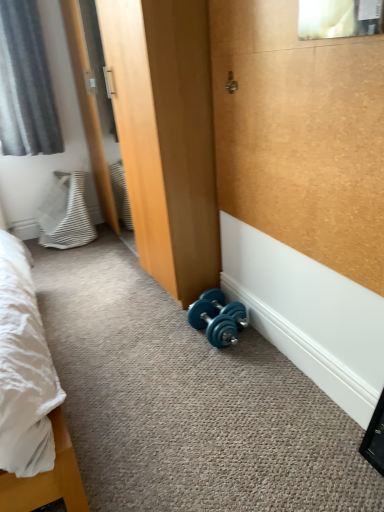
Question: Considering the relative positions of gray fabric curtain at upper left and white striped fabric pillow at left in the image provided, is gray fabric curtain at upper left in front of white striped fabric pillow at left?

Choices:
 (A) yes
 (B) no

Answer: (A)

Question: Is gray fabric curtain at upper left in contact with white striped fabric pillow at left?

Choices:
 (A) no
 (B) yes

Answer: (A)

Question: From a real-world perspective, is gray fabric curtain at upper left physically above white striped fabric pillow at left?

Choices:
 (A) yes
 (B) no

Answer: (A)

Question: Can you confirm if gray fabric curtain at upper left is shorter than white striped fabric pillow at left?

Choices:
 (A) no
 (B) yes

Answer: (A)

Question: Does gray fabric curtain at upper left turn towards white striped fabric pillow at left?

Choices:
 (A) no
 (B) yes

Answer: (A)

Question: Looking at the image, does gray fabric curtain at upper left seem bigger or smaller compared to white striped fabric pillow at left?

Choices:
 (A) big
 (B) small

Answer: (A)

Question: Looking at their shapes, would you say gray fabric curtain at upper left is wider or thinner than white striped fabric pillow at left?

Choices:
 (A) wide
 (B) thin

Answer: (B)

Question: In the image, is gray fabric curtain at upper left on the left side or the right side of white striped fabric pillow at left?

Choices:
 (A) left
 (B) right

Answer: (A)

Question: Does point (16, 31) appear closer or farther from the camera than point (82, 181)?

Choices:
 (A) farther
 (B) closer

Answer: (B)

Question: Considering the positions of teal rubber dumbbell at lower center and gray fabric curtain at upper left in the image, is teal rubber dumbbell at lower center wider or thinner than gray fabric curtain at upper left?

Choices:
 (A) thin
 (B) wide

Answer: (A)

Question: Is point (215, 316) positioned closer to the camera than point (0, 73)?

Choices:
 (A) farther
 (B) closer

Answer: (B)

Question: Is teal rubber dumbbell at lower center bigger or smaller than gray fabric curtain at upper left?

Choices:
 (A) small
 (B) big

Answer: (A)

Question: In terms of height, does teal rubber dumbbell at lower center look taller or shorter compared to gray fabric curtain at upper left?

Choices:
 (A) short
 (B) tall

Answer: (A)

Question: In terms of width, does gray fabric curtain at upper left look wider or thinner when compared to clear glass mirror at upper center?

Choices:
 (A) thin
 (B) wide

Answer: (B)

Question: Considering the relative positions of gray fabric curtain at upper left and clear glass mirror at upper center in the image provided, is gray fabric curtain at upper left to the left or to the right of clear glass mirror at upper center?

Choices:
 (A) right
 (B) left

Answer: (B)